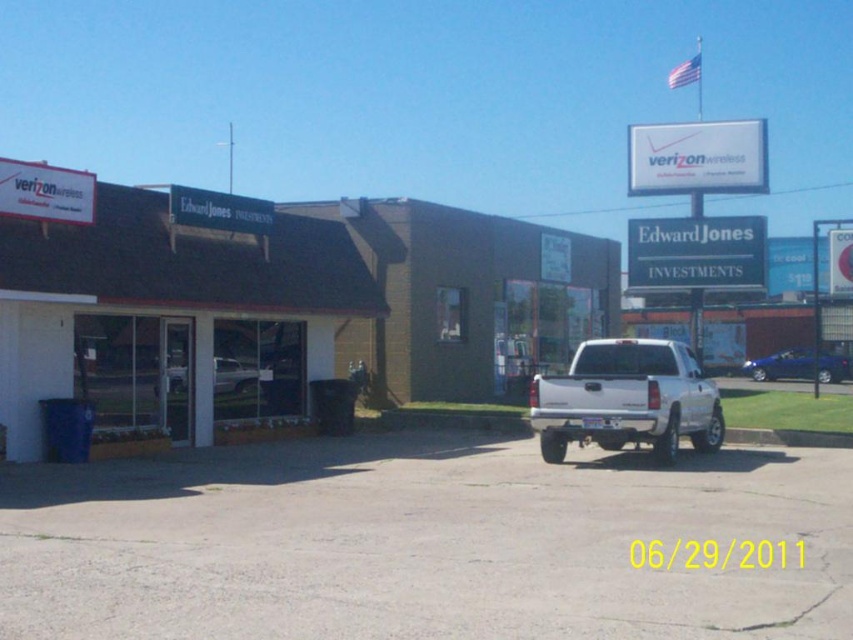
You are standing at the center of the parking lot and want to go to the white brick storefront at left. Which direction should you walk?

The white brick storefront at left is located at point (163, 307), so you should walk towards the left side of the parking lot to reach it.

You are a delivery person needing to park as close as possible to the Verizon Wireless store. Given the white brick storefront at left and the metallic blue sedan at right, which parking spot should you choose?

The white brick storefront at left is closer to the viewer than the metallic blue sedan at right, so you should choose the parking spot near the white brick storefront at left to be closer to the Verizon Wireless store.

You are a delivery person trying to park your silver metallic pickup truck at center in the parking lot. The parking spot you want is marked by point (625, 400). Is your truck currently parked in that spot?

Point (625, 400) marks silver metallic pickup truck at center, so yes, the truck is parked in that spot.